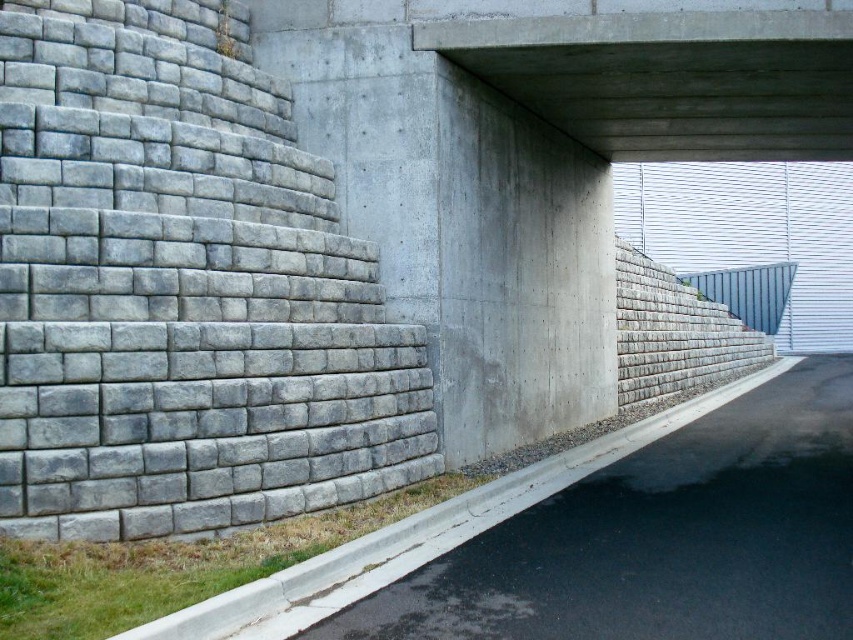
You are a delivery person trying to navigate through a narrow path between the gray concrete curb at lower right and the concrete at upper center. Which object should you avoid hitting if you want to move towards the right side of the image?

You should avoid hitting the gray concrete curb at lower right because it is positioned on the left side of the concrete at upper center, so moving towards the right would require passing by the gray concrete curb at lower right first.

You are a delivery person trying to place a box on the gray concrete curb at lower right. The box requires a surface that is at least as tall as the concrete at upper center. Can you place the box there?

The gray concrete curb at lower right is shorter than the concrete at upper center, so it is not tall enough to meet the box requirement. You cannot place the box there.